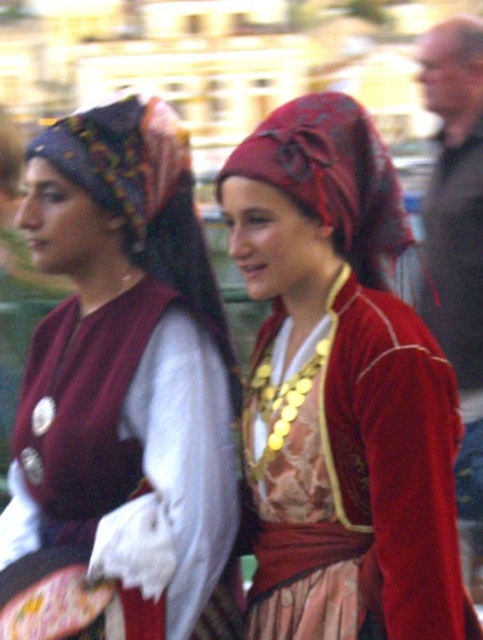
Question: Does matte black headscarf at left have a lesser width compared to matte red fabric headscarf at center?

Choices:
 (A) yes
 (B) no

Answer: (B)

Question: Which object is the closest to the velvet-like red headscarf at center?

Choices:
 (A) matte black headscarf at left
 (B) matte red fabric headscarf at center

Answer: (B)

Question: Which object appears closest to the camera in this image?

Choices:
 (A) matte red fabric headscarf at center
 (B) matte black headscarf at left
 (C) velvet-like red headscarf at center

Answer: (B)

Question: Estimate the real-world distances between objects in this image. Which object is closer to the matte red fabric headscarf at center?

Choices:
 (A) velvet-like red headscarf at center
 (B) matte black headscarf at left

Answer: (A)

Question: Does matte black headscarf at left have a smaller size compared to matte red fabric headscarf at center?

Choices:
 (A) no
 (B) yes

Answer: (A)

Question: Can you confirm if matte black headscarf at left is bigger than velvet-like red headscarf at center?

Choices:
 (A) no
 (B) yes

Answer: (B)